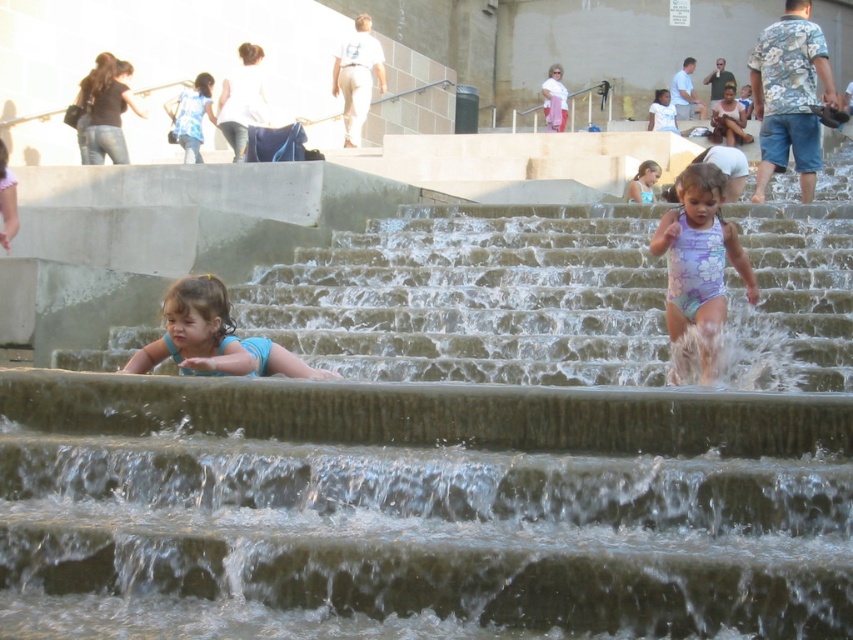
You are a photographer trying to capture both the blue fabric swimsuit at lower left and the blue fabric dress at upper center in the same frame. Which object should you focus on first if you want to include both in your shot?

You should focus on the blue fabric dress at upper center first because the blue fabric swimsuit at lower left is positioned below it, allowing you to frame both by adjusting your angle downward from the dress.

You are a photographer trying to capture both the blue fabric swimsuit at lower left and the blue floral swimsuit at upper center in the same frame. Based on their positions, which swimsuit should you focus on first to ensure both are in the shot?

The blue fabric swimsuit at lower left is to the left of the blue floral swimsuit at upper center, so you should focus on the blue fabric swimsuit at lower left first to ensure both are in the frame.